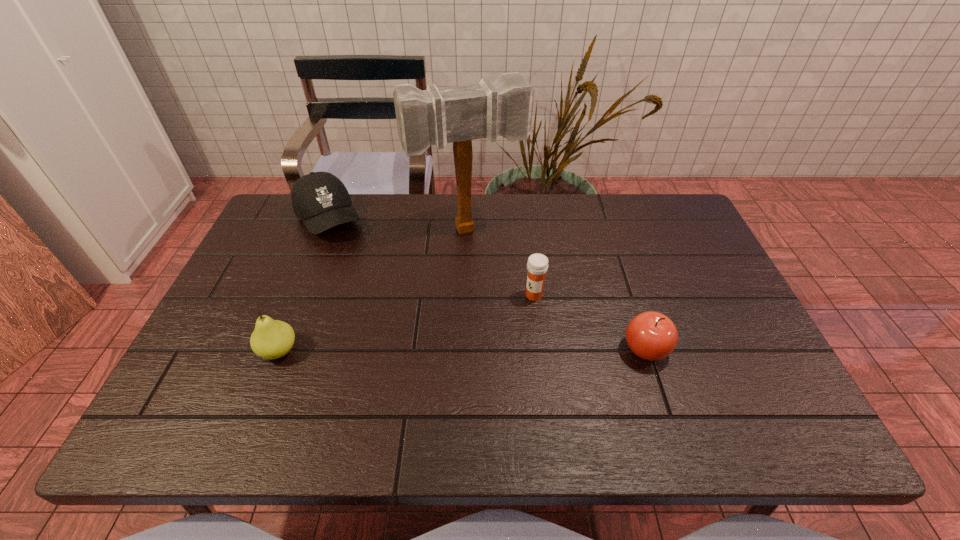
Locate an element on the screen. object that is the closest to the third farthest object is located at coordinates (461, 114).

I want to click on the fourth closest object to the baseball cap, so [x=652, y=336].

Locate an element on the screen. free location that satisfies the following two spatial constraints: 1. on the front side of the rightmost object; 2. on the left side of the third farthest object is located at coordinates (540, 349).

The image size is (960, 540). Find the location of `free spot that satisfies the following two spatial constraints: 1. on the front side of the third farthest object; 2. on the left side of the mallet`. free spot that satisfies the following two spatial constraints: 1. on the front side of the third farthest object; 2. on the left side of the mallet is located at coordinates (466, 295).

You are a GUI agent. You are given a task and a screenshot of the screen. Output one action in this format:
    pyautogui.click(x=<x>, y=<y>)
    Task: Click on the vacant point that satisfies the following two spatial constraints: 1. on the front side of the baseball cap; 2. on the left side of the rightmost object
    
    Given the screenshot: What is the action you would take?
    pyautogui.click(x=277, y=349)